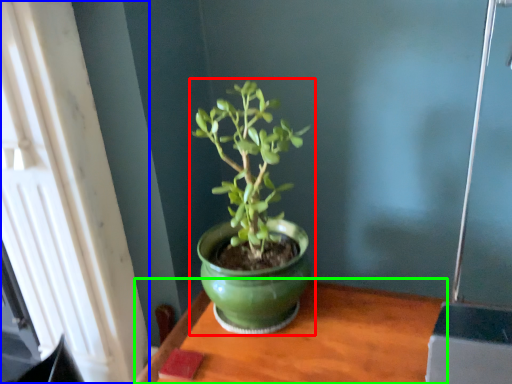
Question: Estimate the real-world distances between objects in this image. Which object is closer to houseplant (highlighted by a red box), window (highlighted by a blue box) or table (highlighted by a green box)?

Choices:
 (A) window
 (B) table

Answer: (B)